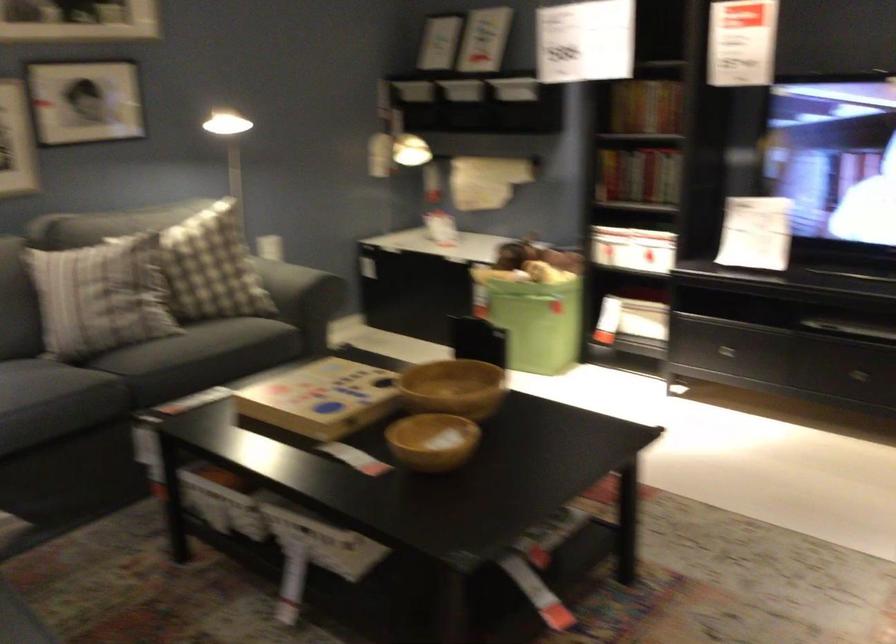
Locate an element on the screen. plaid pillow is located at coordinates (211, 267).